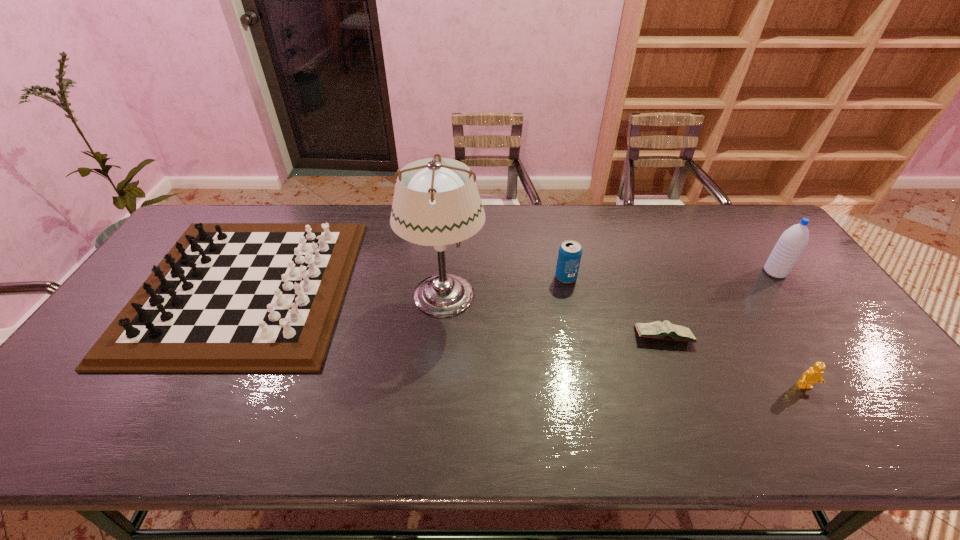
Locate an element on the screen. The width and height of the screenshot is (960, 540). the second object from left to right is located at coordinates tap(436, 202).

What are the coordinates of `the tallest object` in the screenshot? It's located at (436, 202).

Find the location of a particular element. water bottle is located at coordinates (792, 242).

The height and width of the screenshot is (540, 960). What are the coordinates of `the rightmost object` in the screenshot? It's located at (792, 242).

I want to click on the third object from left to right, so click(x=570, y=251).

Where is `gameboard`? The width and height of the screenshot is (960, 540). gameboard is located at coordinates tap(228, 297).

The height and width of the screenshot is (540, 960). Identify the location of the nearest object. pos(814,374).

Identify the location of the second shortest object. (814, 374).

You are a GUI agent. You are given a task and a screenshot of the screen. Output one action in this format:
    pyautogui.click(x=<x>, y=<y>)
    Task: Click on the third object from right to left
    
    Given the screenshot: What is the action you would take?
    pyautogui.click(x=665, y=330)

Find the location of a particular element. This screenshot has width=960, height=540. diary is located at coordinates (665, 330).